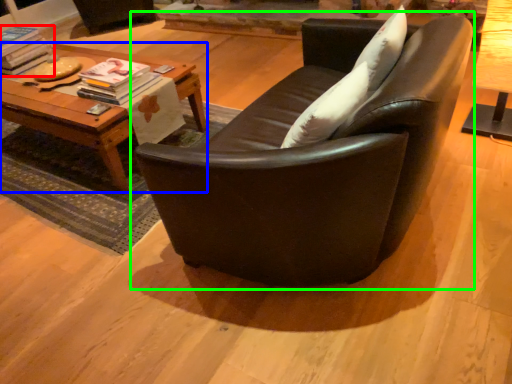
Question: Which object is the closest to the magazine (highlighted by a red box)? Choose among these: table (highlighted by a blue box) or studio couch (highlighted by a green box).

Choices:
 (A) table
 (B) studio couch

Answer: (A)